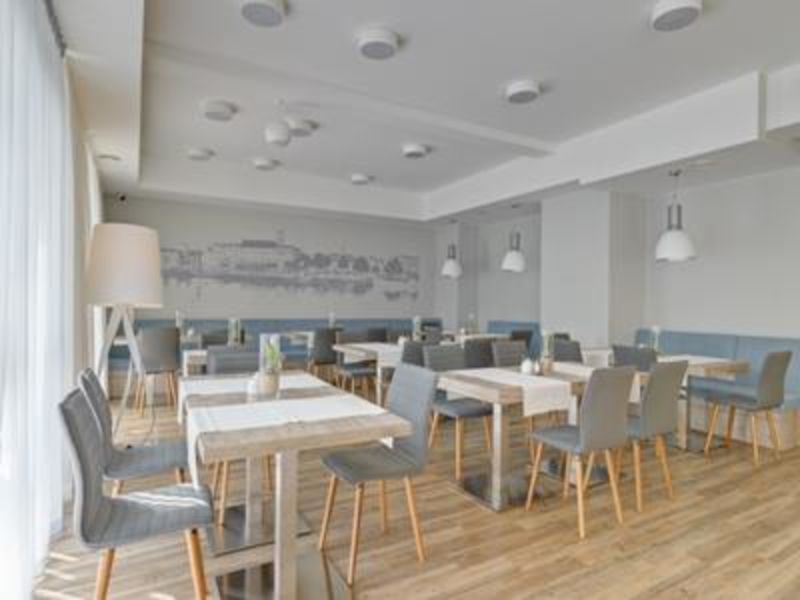
The image size is (800, 600). In order to click on tables in this screenshot , I will do `click(308, 439)`, `click(496, 396)`, `click(702, 367)`, `click(389, 346)`, `click(477, 333)`, `click(306, 334)`, `click(200, 352)`, `click(189, 342)`.